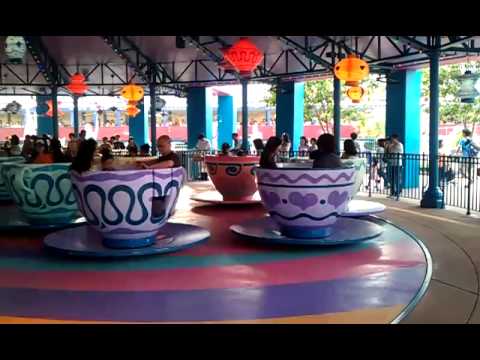
This screenshot has height=360, width=480. I want to click on purple stripe pattern on floor, so click(361, 290), click(261, 304), click(159, 306), click(40, 298).